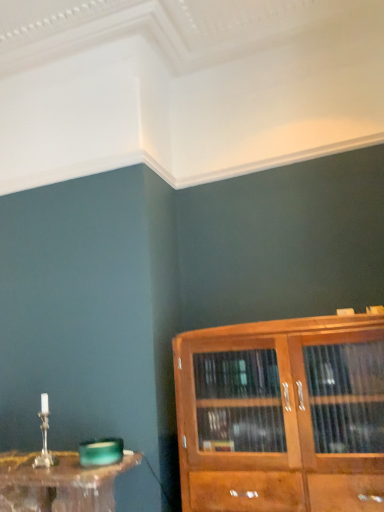
This screenshot has height=512, width=384. Find the location of `wooden cabinet at right`. wooden cabinet at right is located at coordinates point(282,415).

What is the approximate height of wooden cabinet at right?

The height of wooden cabinet at right is 29.78 inches.

The width and height of the screenshot is (384, 512). Describe the element at coordinates (282, 415) in the screenshot. I see `wooden cabinet at right` at that location.

Image resolution: width=384 pixels, height=512 pixels. What do you see at coordinates (58, 483) in the screenshot? I see `translucent glass table at lower left` at bounding box center [58, 483].

What is the approximate width of translucent glass table at lower left?

It is 12.62 inches.

Find the location of a particular element. translucent glass table at lower left is located at coordinates (58, 483).

This screenshot has height=512, width=384. In order to click on wooden cabinet at right in this screenshot , I will do `click(282, 415)`.

Considering the relative positions of translucent glass table at lower left and wooden cabinet at right in the image provided, is translucent glass table at lower left to the right of wooden cabinet at right from the viewer's perspective?

In fact, translucent glass table at lower left is to the left of wooden cabinet at right.

Which object is further away from the camera, translucent glass table at lower left or wooden cabinet at right?

translucent glass table at lower left is further away from the camera.

Considering the positions of point (6, 509) and point (376, 418), is point (6, 509) closer or farther from the camera than point (376, 418)?

Point (6, 509) is farther from the camera than point (376, 418).

From the image's perspective, is translucent glass table at lower left beneath wooden cabinet at right?

Yes, from the image's perspective, translucent glass table at lower left is below wooden cabinet at right.

From a real-world perspective, which is physically below, translucent glass table at lower left or wooden cabinet at right?

From a 3D spatial view, translucent glass table at lower left is below.

Considering the relative sizes of translucent glass table at lower left and wooden cabinet at right in the image provided, is translucent glass table at lower left wider than wooden cabinet at right?

In fact, translucent glass table at lower left might be narrower than wooden cabinet at right.

In terms of height, does translucent glass table at lower left look taller or shorter compared to wooden cabinet at right?

Considering their sizes, translucent glass table at lower left has less height than wooden cabinet at right.

Who is bigger, translucent glass table at lower left or wooden cabinet at right?

wooden cabinet at right.

Is translucent glass table at lower left inside or outside of wooden cabinet at right?

translucent glass table at lower left is outside wooden cabinet at right.

Is translucent glass table at lower left in contact with wooden cabinet at right?

No, translucent glass table at lower left is not touching wooden cabinet at right.

Is translucent glass table at lower left oriented towards wooden cabinet at right?

No, translucent glass table at lower left does not turn towards wooden cabinet at right.

How different are the orientations of translucent glass table at lower left and wooden cabinet at right in degrees?

There is a 0.13-degree angle between the facing directions of translucent glass table at lower left and wooden cabinet at right.

How far apart are translucent glass table at lower left and wooden cabinet at right?

translucent glass table at lower left and wooden cabinet at right are 20.44 inches apart.

The image size is (384, 512). I want to click on cupboard that appears above the translucent glass table at lower left (from the image's perspective), so click(x=282, y=415).

Is wooden cabinet at right at the left side of translucent glass table at lower left?

No.

Relative to translucent glass table at lower left, is wooden cabinet at right in front or behind?

In the image, wooden cabinet at right appears in front of translucent glass table at lower left.

Is point (343, 455) closer or farther from the camera than point (78, 471)?

Clearly, point (343, 455) is closer to the camera than point (78, 471).

From the image's perspective, is wooden cabinet at right above or below translucent glass table at lower left?

wooden cabinet at right is above translucent glass table at lower left.

From a real-world perspective, is wooden cabinet at right positioned above or below translucent glass table at lower left?

wooden cabinet at right is above translucent glass table at lower left.

Based on the photo, considering the sizes of objects wooden cabinet at right and translucent glass table at lower left in the image provided, who is thinner, wooden cabinet at right or translucent glass table at lower left?

With smaller width is translucent glass table at lower left.

Can you confirm if wooden cabinet at right is taller than translucent glass table at lower left?

Yes.

Considering the sizes of objects wooden cabinet at right and translucent glass table at lower left in the image provided, who is bigger, wooden cabinet at right or translucent glass table at lower left?

Bigger between the two is wooden cabinet at right.

Is wooden cabinet at right outside of translucent glass table at lower left?

Absolutely, wooden cabinet at right is external to translucent glass table at lower left.

Is wooden cabinet at right next to translucent glass table at lower left?

wooden cabinet at right is not next to translucent glass table at lower left, and they're not touching.

Is wooden cabinet at right positioned with its back to translucent glass table at lower left?

That's not correct — wooden cabinet at right is not looking away from translucent glass table at lower left.

Measure the distance between wooden cabinet at right and translucent glass table at lower left.

wooden cabinet at right and translucent glass table at lower left are 51.92 centimeters apart.

Locate an element on the screen. The width and height of the screenshot is (384, 512). cupboard in front of the translucent glass table at lower left is located at coordinates (282, 415).

Identify the location of cupboard that appears on the right of translucent glass table at lower left. The height and width of the screenshot is (512, 384). (282, 415).

The width and height of the screenshot is (384, 512). I want to click on table below the wooden cabinet at right (from a real-world perspective), so click(58, 483).